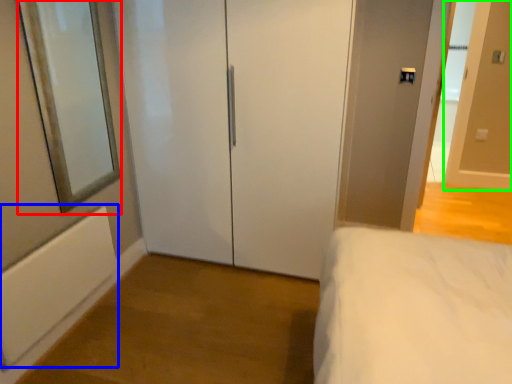
Question: Considering the real-world distances, which object is closest to mirror (highlighted by a red box)? radiator (highlighted by a blue box) or door (highlighted by a green box).

Choices:
 (A) radiator
 (B) door

Answer: (A)